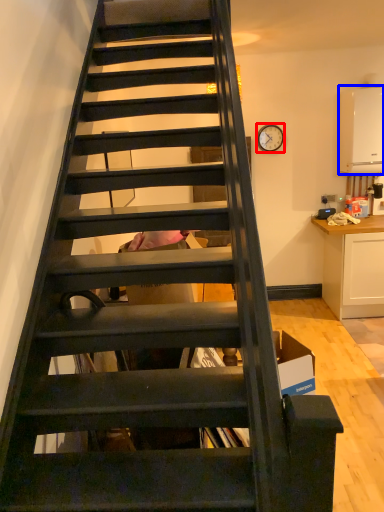
Question: Which object appears farthest to the camera in this image, clock (highlighted by a red box) or appliance (highlighted by a blue box)?

Choices:
 (A) clock
 (B) appliance

Answer: (A)